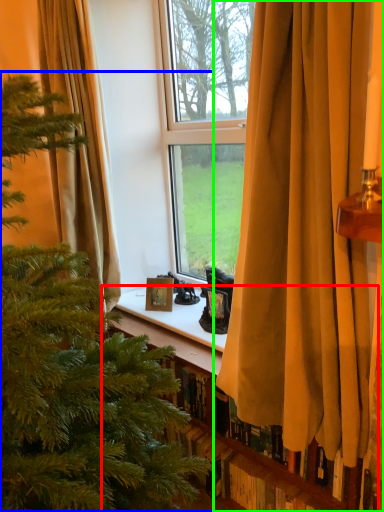
Question: Considering the real-world distances, which object is closest to bookshelf (highlighted by a red box)? christmas tree (highlighted by a blue box) or curtain (highlighted by a green box).

Choices:
 (A) christmas tree
 (B) curtain

Answer: (B)